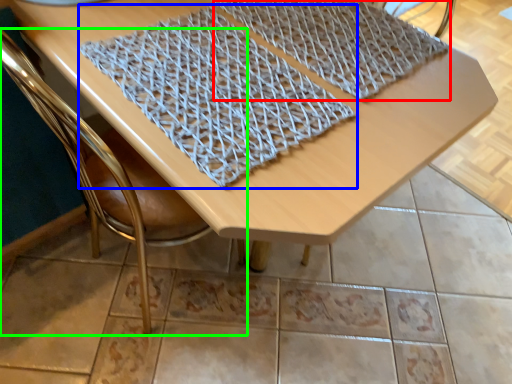
Question: Which is nearer to the blanket (highlighted by a red box)? blanket (highlighted by a blue box) or chair (highlighted by a green box).

Choices:
 (A) blanket
 (B) chair

Answer: (A)